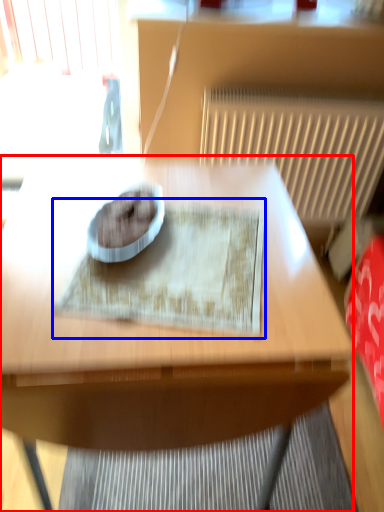
Question: Among these objects, which one is nearest to the camera, table (highlighted by a red box) or mat (highlighted by a blue box)?

Choices:
 (A) table
 (B) mat

Answer: (A)